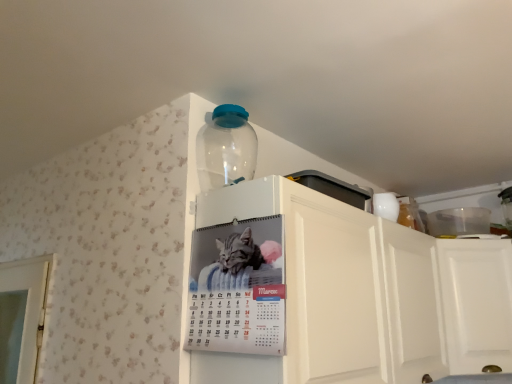
Where is `metallic silver calendar at upper center`? metallic silver calendar at upper center is located at coordinates (238, 288).

Considering the relative positions of transparent plastic bottle at upper center and metallic silver calendar at upper center in the image provided, is transparent plastic bottle at upper center behind metallic silver calendar at upper center?

That is True.

Which object is thinner, transparent plastic bottle at upper center or metallic silver calendar at upper center?

With smaller width is metallic silver calendar at upper center.

Which is less distant, (217, 136) or (208, 328)?

Positioned in front is point (208, 328).

In the scene shown: From the image's perspective, which one is positioned higher, transparent plastic bottle at upper center or metallic silver calendar at upper center?

transparent plastic bottle at upper center, from the image's perspective.

Consider the image. How many degrees apart are the facing directions of transparent plastic bottle at upper center and white matte cabinet at upper center?

6.63 degrees separate the facing orientations of transparent plastic bottle at upper center and white matte cabinet at upper center.

Is transparent plastic bottle at upper center looking in the opposite direction of white matte cabinet at upper center?

transparent plastic bottle at upper center does not have its back to white matte cabinet at upper center.

Is there a large distance between transparent plastic bottle at upper center and white matte cabinet at upper center?

No, transparent plastic bottle at upper center is not far away from white matte cabinet at upper center.

Considering the sizes of transparent plastic bottle at upper center and white matte cabinet at upper center in the image, is transparent plastic bottle at upper center taller or shorter than white matte cabinet at upper center?

Clearly, transparent plastic bottle at upper center is shorter compared to white matte cabinet at upper center.

From the picture: Is white matte cabinet at upper center behind transparent plastic bottle at upper center?

No, white matte cabinet at upper center is closer to the viewer.

Is point (414, 291) positioned before point (250, 157)?

No, (414, 291) is further to viewer.

From a real-world perspective, is white matte cabinet at upper center located beneath transparent plastic bottle at upper center?

Yes.

Is white matte cabinet at upper center oriented away from transparent plastic bottle at upper center?

No, transparent plastic bottle at upper center is not at the back of white matte cabinet at upper center.

Which is more to the right, metallic silver calendar at upper center or transparent plastic bottle at upper center?

metallic silver calendar at upper center.

From a real-world perspective, is metallic silver calendar at upper center located higher than transparent plastic bottle at upper center?

No, from a real-world perspective, metallic silver calendar at upper center is not on top of transparent plastic bottle at upper center.

Considering the sizes of objects metallic silver calendar at upper center and transparent plastic bottle at upper center in the image provided, who is thinner, metallic silver calendar at upper center or transparent plastic bottle at upper center?

Thinner between the two is metallic silver calendar at upper center.

Would you consider metallic silver calendar at upper center to be distant from transparent plastic bottle at upper center?

metallic silver calendar at upper center is actually quite close to transparent plastic bottle at upper center.

Which of these two, metallic silver calendar at upper center or white matte cabinet at upper center, stands shorter?

With less height is metallic silver calendar at upper center.

From a real-world perspective, is metallic silver calendar at upper center located higher than white matte cabinet at upper center?

Yes, from a real-world perspective, metallic silver calendar at upper center is above white matte cabinet at upper center.

Is point (258, 286) closer or farther from the camera than point (509, 322)?

Clearly, point (258, 286) is closer to the camera than point (509, 322).

How much distance is there between metallic silver calendar at upper center and white matte cabinet at upper center?

A distance of 6.68 inches exists between metallic silver calendar at upper center and white matte cabinet at upper center.

Is white matte cabinet at upper center directly adjacent to metallic silver calendar at upper center?

No, white matte cabinet at upper center is not next to metallic silver calendar at upper center.

Can you confirm if white matte cabinet at upper center is shorter than metallic silver calendar at upper center?

In fact, white matte cabinet at upper center may be taller than metallic silver calendar at upper center.

Does white matte cabinet at upper center have a smaller size compared to metallic silver calendar at upper center?

No, white matte cabinet at upper center is not smaller than metallic silver calendar at upper center.

Between point (369, 345) and point (274, 325), which one is positioned in front?

The point (274, 325) is more forward.

There is a metallic silver calendar at upper center. Identify the location of bottle above it (from a real-world perspective). (226, 148).

Identify the location of cabinetry on the right of transparent plastic bottle at upper center. (367, 294).

Based on their spatial positions, is transparent plastic bottle at upper center or metallic silver calendar at upper center further from white matte cabinet at upper center?

Based on the image, transparent plastic bottle at upper center appears to be further to white matte cabinet at upper center.

When comparing their distances from metallic silver calendar at upper center, does transparent plastic bottle at upper center or white matte cabinet at upper center seem further?

transparent plastic bottle at upper center.

Considering their positions, is white matte cabinet at upper center positioned further to transparent plastic bottle at upper center than metallic silver calendar at upper center?

white matte cabinet at upper center is positioned further to the anchor transparent plastic bottle at upper center.

Considering their positions, is metallic silver calendar at upper center positioned closer to white matte cabinet at upper center than transparent plastic bottle at upper center?

Among the two, metallic silver calendar at upper center is located nearer to white matte cabinet at upper center.

From the picture: Based on their spatial positions, is white matte cabinet at upper center or transparent plastic bottle at upper center further from metallic silver calendar at upper center?

transparent plastic bottle at upper center is positioned further to the anchor metallic silver calendar at upper center.

Estimate the real-world distances between objects in this image. Which object is closer to transparent plastic bottle at upper center, metallic silver calendar at upper center or white matte cabinet at upper center?

metallic silver calendar at upper center is closer to transparent plastic bottle at upper center.

Locate an element on the screen. poster that lies between transparent plastic bottle at upper center and white matte cabinet at upper center from top to bottom is located at coordinates (238, 288).